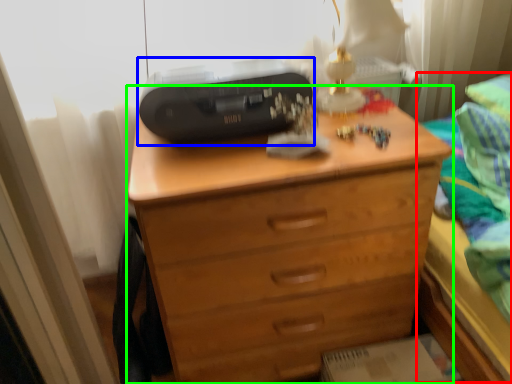
Question: Considering the real-world distances, which object is farthest from bed (highlighted by a red box)? printer (highlighted by a blue box) or chest of drawers (highlighted by a green box)?

Choices:
 (A) printer
 (B) chest of drawers

Answer: (A)